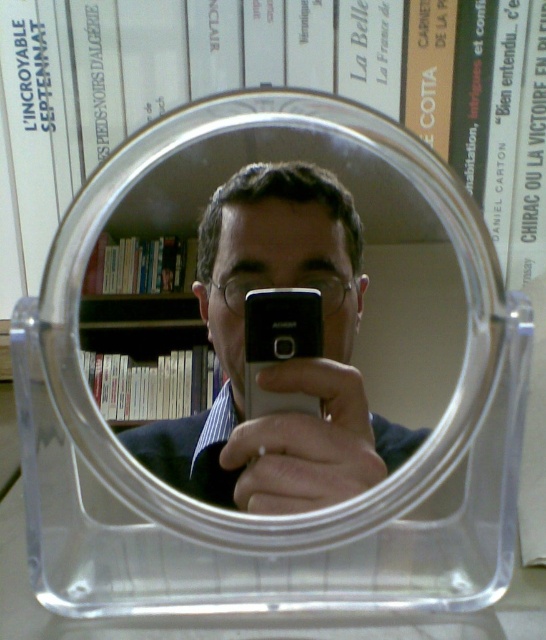
Is point (395, 152) positioned in front of point (278, 321)?

No, it is behind (278, 321).

Looking at this image, who is more forward, (446, 486) or (299, 330)?

Point (299, 330) is more forward.

Locate an element on the screen. Image resolution: width=546 pixels, height=640 pixels. clear plastic mirror at center is located at coordinates (364, 253).